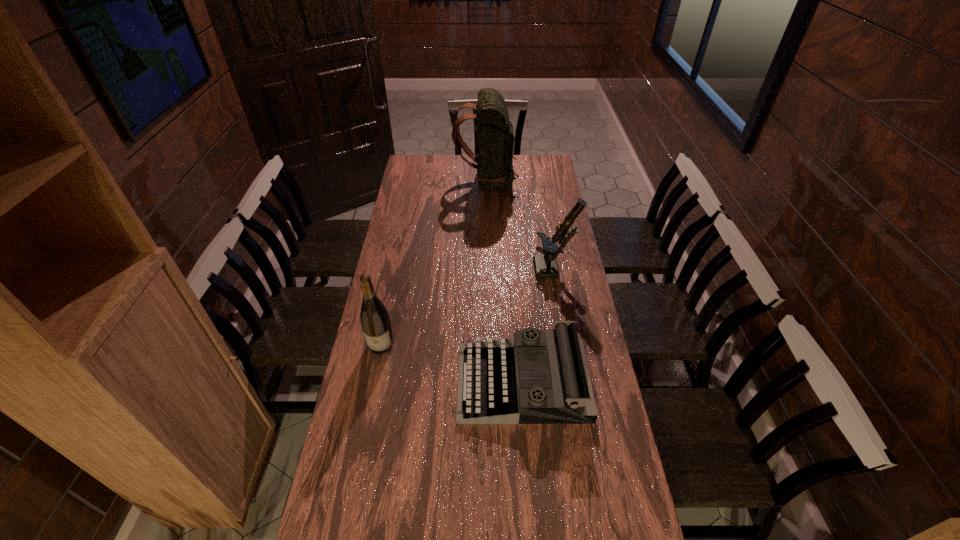
Locate an element on the screen. the farthest object is located at coordinates (495, 172).

The width and height of the screenshot is (960, 540). What are the coordinates of `backpack` in the screenshot? It's located at (495, 172).

Image resolution: width=960 pixels, height=540 pixels. I want to click on the second farthest object, so click(x=545, y=264).

Image resolution: width=960 pixels, height=540 pixels. What are the coordinates of `the leftmost object` in the screenshot? It's located at (375, 321).

Image resolution: width=960 pixels, height=540 pixels. What are the coordinates of `typewriter` in the screenshot? It's located at (538, 376).

Identify the location of vacant region located on the back of the farthest object. The height and width of the screenshot is (540, 960). (407, 181).

Image resolution: width=960 pixels, height=540 pixels. I want to click on vacant point located on the back of the farthest object, so click(x=433, y=181).

Image resolution: width=960 pixels, height=540 pixels. I want to click on vacant area situated 0.180m on the back of the farthest object, so [x=419, y=181].

I want to click on free location located at the eyepiece of the third nearest object, so click(x=509, y=270).

Where is `free space located at the eyepiece of the third nearest object`? This screenshot has height=540, width=960. free space located at the eyepiece of the third nearest object is located at coordinates (521, 270).